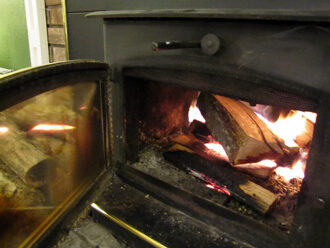
I want to click on wall, so click(x=7, y=29).